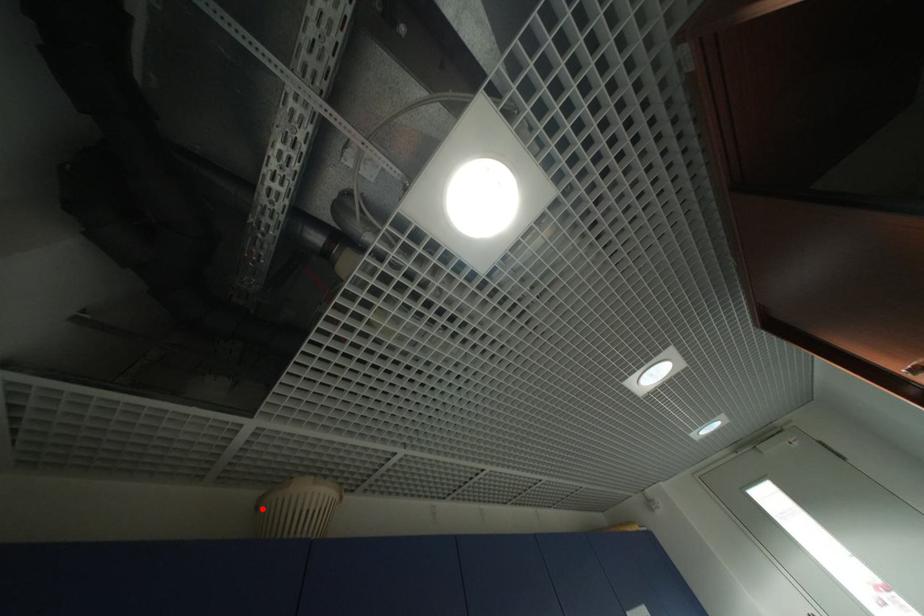
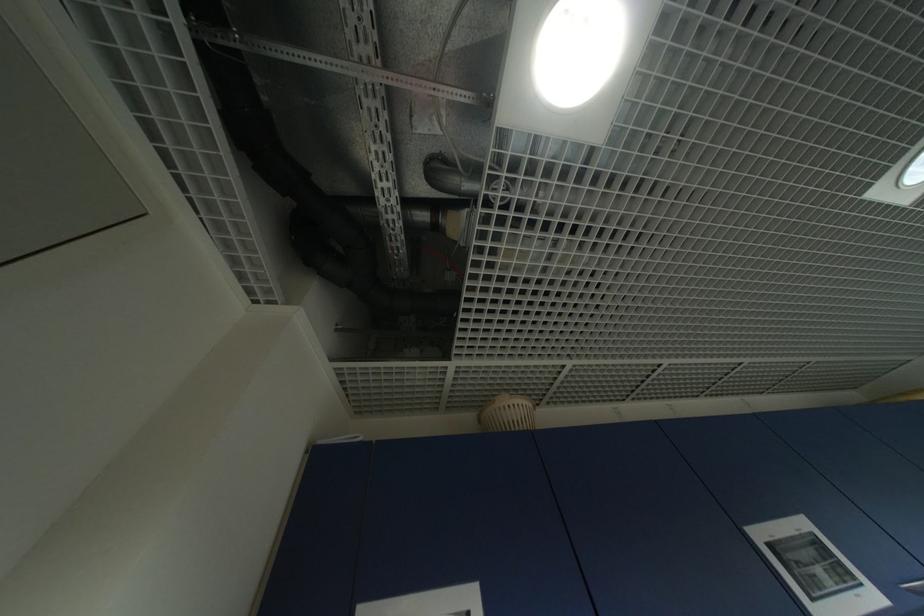
In the second image, find the point that corresponds to the highlighted location in the first image.

(485, 422)